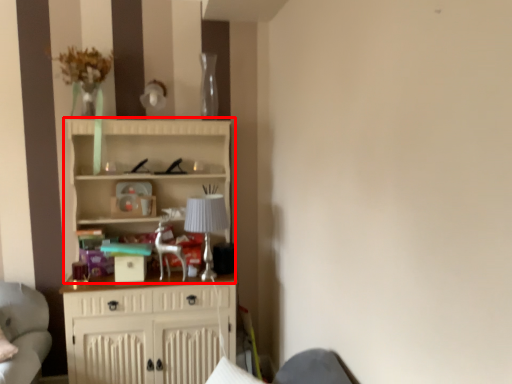
Question: From the image's perspective, considering the relative positions of cupboard (annotated by the red box) and lamp in the image provided, where is cupboard (annotated by the red box) located with respect to the staircase?

Choices:
 (A) below
 (B) above

Answer: (A)